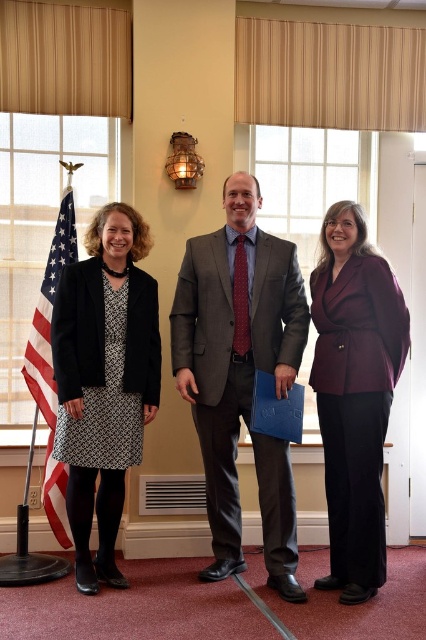
Who is positioned more to the left, burgundy wool blazer at center or blue matte folder at center?

blue matte folder at center is more to the left.

Can you confirm if burgundy wool blazer at center is smaller than blue matte folder at center?

No.

Locate an element on the screen. The width and height of the screenshot is (426, 640). burgundy wool blazer at center is located at coordinates (354, 394).

Locate an element on the screen. burgundy wool blazer at center is located at coordinates (354, 394).

Can you confirm if american flag at left is positioned to the right of blue matte folder at center?

Incorrect, american flag at left is not on the right side of blue matte folder at center.

Does american flag at left appear over blue matte folder at center?

Yes.

This screenshot has height=640, width=426. What are the coordinates of `american flag at left` in the screenshot? It's located at (51, 365).

Between matte black blazer at left and burgundy wool blazer at center, which one has less height?

With less height is matte black blazer at left.

Looking at this image, who is more forward, (103,378) or (379,332)?

Point (379,332) is more forward.

You are a GUI agent. You are given a task and a screenshot of the screen. Output one action in this format:
    pyautogui.click(x=<x>, y=<y>)
    Task: Click on the matte black blazer at left
    This screenshot has width=426, height=640.
    Given the screenshot: What is the action you would take?
    pyautogui.click(x=103, y=380)

Locate an element on the screen. matte black blazer at left is located at coordinates (103, 380).